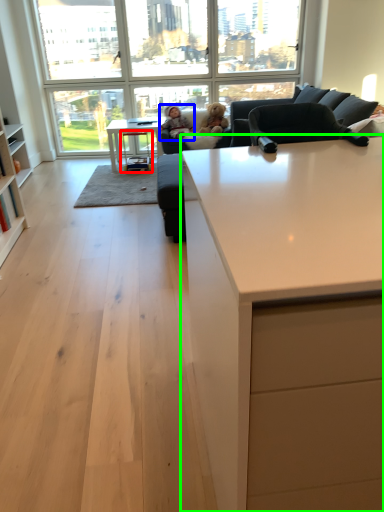
Question: Which object is positioned closest to stool (highlighted by a red box)? Select from person (highlighted by a blue box) and countertop (highlighted by a green box).

Choices:
 (A) person
 (B) countertop

Answer: (A)